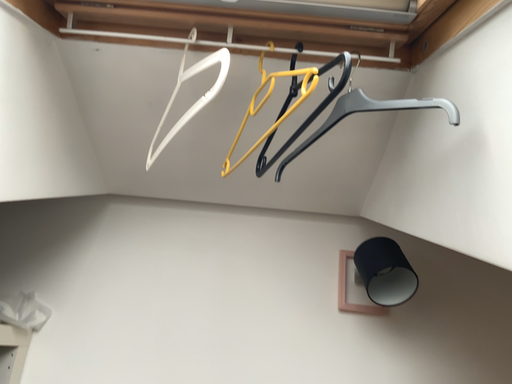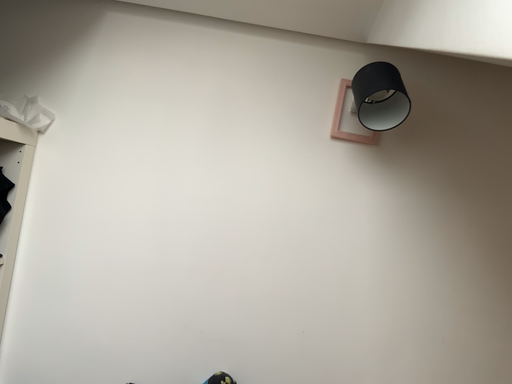
Question: How did the camera likely rotate when shooting the video?

Choices:
 (A) rotated upward
 (B) rotated downward

Answer: (B)